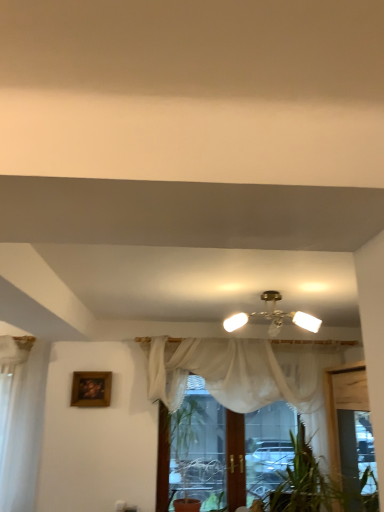
Question: Can you confirm if white sheer curtain at center is positioned to the right of matte brass chandelier at center?

Choices:
 (A) yes
 (B) no

Answer: (B)

Question: Is matte brass chandelier at center a part of white sheer curtain at center?

Choices:
 (A) yes
 (B) no

Answer: (B)

Question: Is white sheer curtain at center completely or partially outside of matte brass chandelier at center?

Choices:
 (A) no
 (B) yes

Answer: (B)

Question: Is white sheer curtain at center closer to camera compared to matte brass chandelier at center?

Choices:
 (A) yes
 (B) no

Answer: (B)

Question: From a real-world perspective, is white sheer curtain at center positioned over matte brass chandelier at center based on gravity?

Choices:
 (A) no
 (B) yes

Answer: (A)

Question: From the image's perspective, relative to white sheer curtain at center, is matte brass chandelier at center above or below?

Choices:
 (A) above
 (B) below

Answer: (A)

Question: In terms of width, does matte brass chandelier at center look wider or thinner when compared to white sheer curtain at center?

Choices:
 (A) wide
 (B) thin

Answer: (A)

Question: From a real-world perspective, is matte brass chandelier at center positioned above or below white sheer curtain at center?

Choices:
 (A) below
 (B) above

Answer: (B)

Question: Is point (264, 298) positioned closer to the camera than point (182, 350)?

Choices:
 (A) closer
 (B) farther

Answer: (A)

Question: From a real-world perspective, is white sheer curtain at center positioned above or below matte brass chandelier at center?

Choices:
 (A) above
 (B) below

Answer: (B)

Question: Relative to matte brass chandelier at center, is white sheer curtain at center in front or behind?

Choices:
 (A) behind
 (B) front

Answer: (A)

Question: Is white sheer curtain at center bigger or smaller than matte brass chandelier at center?

Choices:
 (A) big
 (B) small

Answer: (A)

Question: From their relative heights in the image, would you say white sheer curtain at center is taller or shorter than matte brass chandelier at center?

Choices:
 (A) short
 (B) tall

Answer: (B)

Question: Considering the positions of wooden framed painting at upper left and matte brass chandelier at center in the image, is wooden framed painting at upper left wider or thinner than matte brass chandelier at center?

Choices:
 (A) thin
 (B) wide

Answer: (A)

Question: Is wooden framed painting at upper left inside the boundaries of matte brass chandelier at center, or outside?

Choices:
 (A) inside
 (B) outside

Answer: (B)